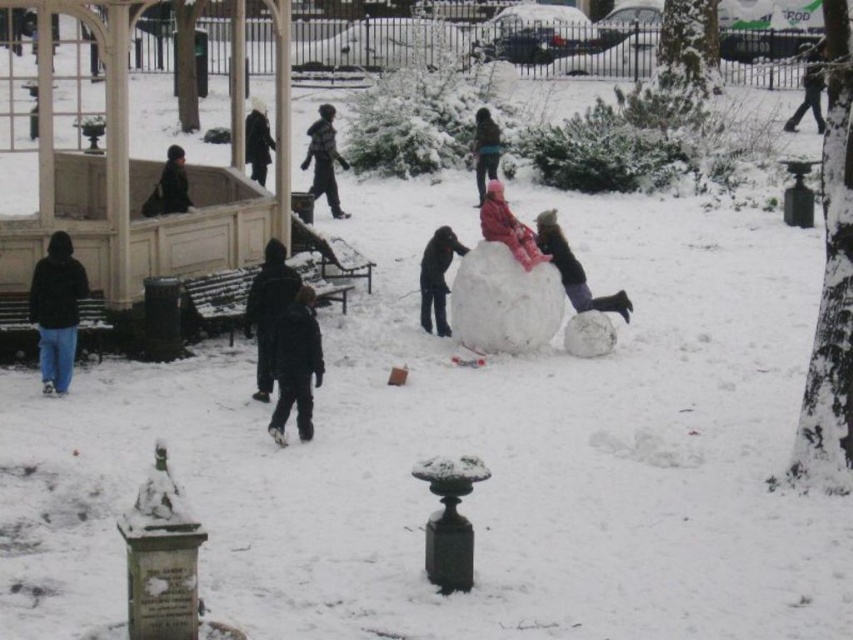
Question: Which object is farther from the camera taking this photo?

Choices:
 (A) fluffy snowball at center
 (B) black matte jacket at center
 (C) black matte jacket at left
 (D) dark brown jacket at upper left

Answer: (D)

Question: Among these points, which one is nearest to the camera?

Choices:
 (A) (807, 54)
 (B) (553, 248)
 (C) (490, 218)

Answer: (C)

Question: Which object is the closest to the black matte jacket at center?

Choices:
 (A) black matte snowball at center
 (B) dark blue jacket at center
 (C) dark gray jacket at center
 (D) pink fabric snowman at center

Answer: (C)

Question: Observing the image, what is the correct spatial positioning of black matte jacket at left in reference to dark gray jacket at center?

Choices:
 (A) above
 (B) below

Answer: (A)

Question: Is dark gray sweater at center positioned behind dark gray jacket at upper right?

Choices:
 (A) no
 (B) yes

Answer: (B)

Question: Is dark gray jacket at center thinner than dark gray jacket at upper right?

Choices:
 (A) no
 (B) yes

Answer: (B)